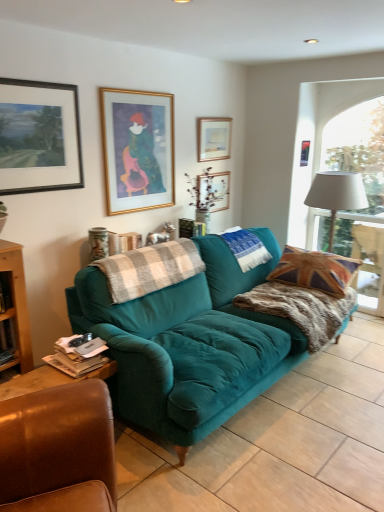
Question: Considering the relative sizes of teal velvet sofa at center and plaid wool blanket at center, the third blanket in the right-to-left sequence, in the image provided, is teal velvet sofa at center bigger than plaid wool blanket at center, the third blanket in the right-to-left sequence,?

Choices:
 (A) yes
 (B) no

Answer: (A)

Question: Is teal velvet sofa at center to the right of plaid wool blanket at center, which is counted as the first blanket, starting from the left, from the viewer's perspective?

Choices:
 (A) yes
 (B) no

Answer: (A)

Question: Is teal velvet sofa at center wider than plaid wool blanket at center, the third blanket in the right-to-left sequence?

Choices:
 (A) no
 (B) yes

Answer: (B)

Question: From a real-world perspective, is teal velvet sofa at center physically above plaid wool blanket at center, the third blanket in the right-to-left sequence?

Choices:
 (A) yes
 (B) no

Answer: (B)

Question: Is plaid wool blanket at center, the third blanket in the right-to-left sequence, completely or partially inside teal velvet sofa at center?

Choices:
 (A) yes
 (B) no

Answer: (B)

Question: Is point (210, 193) positioned closer to the camera than point (205, 126)?

Choices:
 (A) farther
 (B) closer

Answer: (B)

Question: From a real-world perspective, relative to gold-framed picture at upper center, which is counted as the fourth picture frame, starting from the left, is matte white picture frame at upper center, placed as the 3th picture frame when sorted from left to right, vertically above or below?

Choices:
 (A) above
 (B) below

Answer: (B)

Question: In terms of size, does matte white picture frame at upper center, which is counted as the 3th picture frame, starting from the right, appear bigger or smaller than gold-framed picture at upper center, which is counted as the fourth picture frame, starting from the left?

Choices:
 (A) small
 (B) big

Answer: (A)

Question: Considering their positions, is matte white picture frame at upper center, placed as the 3th picture frame when sorted from left to right, located in front of or behind gold-framed picture at upper center, acting as the second picture frame starting from the right?

Choices:
 (A) behind
 (B) front

Answer: (A)

Question: Looking at their shapes, would you say union jack fabric pillow at right is wider or thinner than teal velvet sofa at center?

Choices:
 (A) thin
 (B) wide

Answer: (A)

Question: Considering their positions, is union jack fabric pillow at right located in front of or behind teal velvet sofa at center?

Choices:
 (A) behind
 (B) front

Answer: (A)

Question: From the image's perspective, is union jack fabric pillow at right above or below teal velvet sofa at center?

Choices:
 (A) above
 (B) below

Answer: (A)

Question: Based on their positions, is union jack fabric pillow at right located to the left or right of teal velvet sofa at center?

Choices:
 (A) left
 (B) right

Answer: (B)

Question: Is point (x=306, y=292) closer or farther from the camera than point (x=355, y=194)?

Choices:
 (A) farther
 (B) closer

Answer: (B)

Question: From a real-world perspective, is fuzzy brown blanket at right, which ranks as the first blanket in right-to-left order, positioned above or below white fabric lampshade at right?

Choices:
 (A) above
 (B) below

Answer: (B)